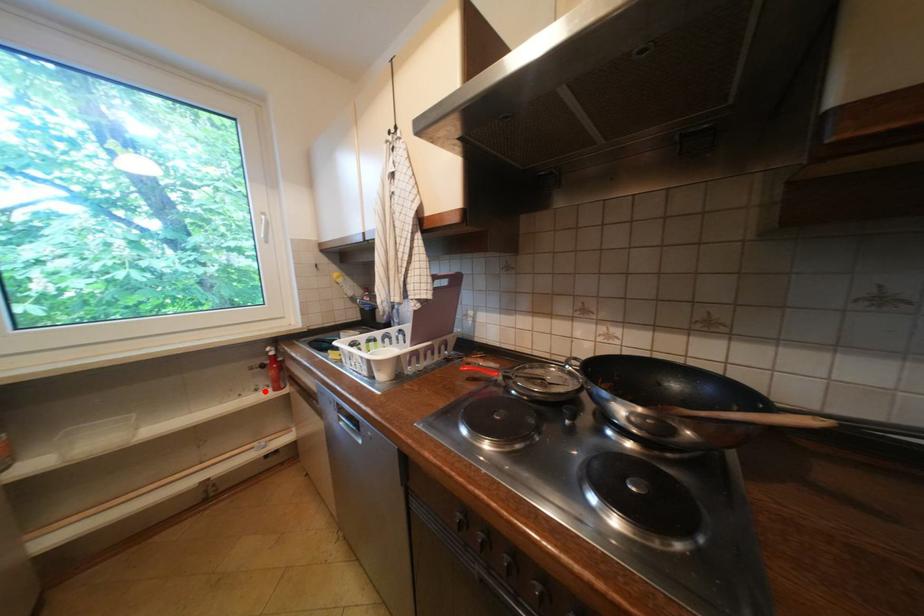
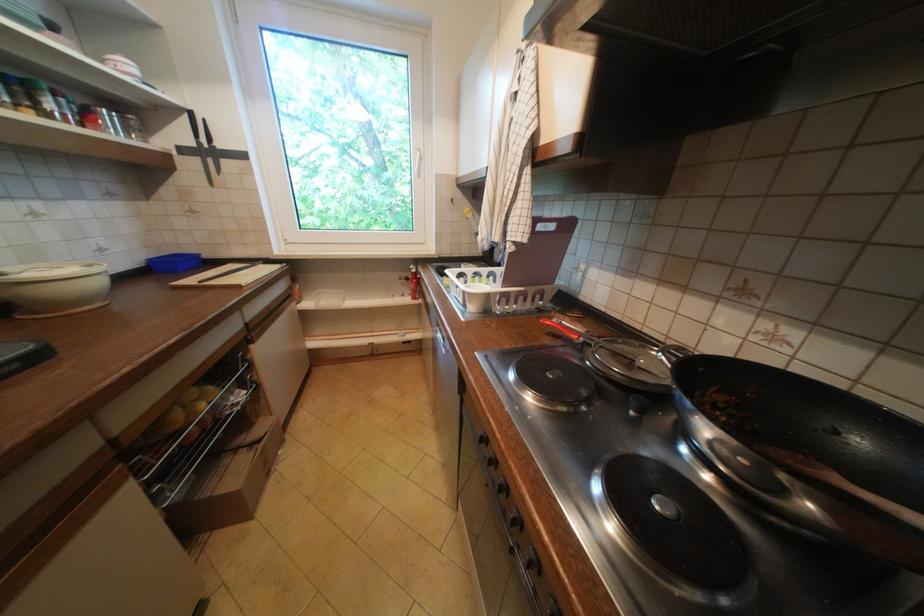
The point at the highlighted location is marked in the first image. Where is the corresponding point in the second image?

(410, 296)